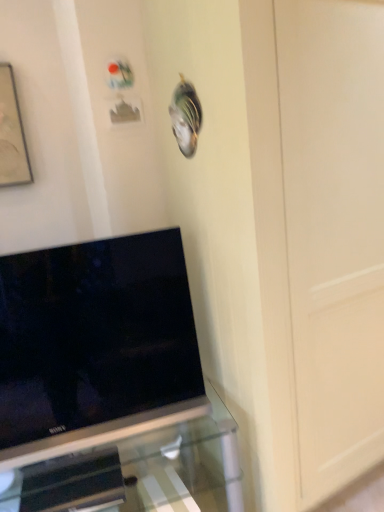
Question: Considering their positions, is transparent glass tv stand at lower left located in front of or behind black glossy tv at lower left?

Choices:
 (A) behind
 (B) front

Answer: (B)

Question: Is transparent glass tv stand at lower left spatially inside black glossy tv at lower left, or outside of it?

Choices:
 (A) outside
 (B) inside

Answer: (A)

Question: Estimate the real-world distances between objects in this image. Which object is closer to the transparent glass tv stand at lower left?

Choices:
 (A) matte black picture frame at upper left
 (B) black glossy tv at lower left

Answer: (B)

Question: Which of these objects is positioned farthest from the black glossy tv at lower left?

Choices:
 (A) transparent glass tv stand at lower left
 (B) matte black picture frame at upper left

Answer: (B)